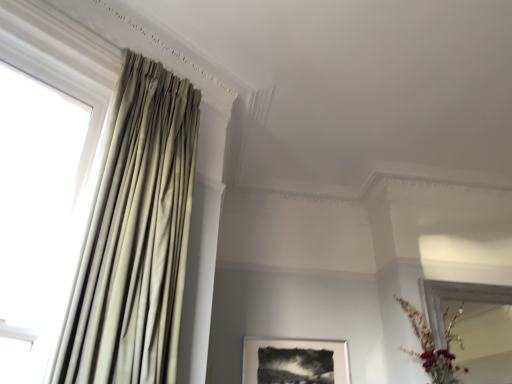
The height and width of the screenshot is (384, 512). Describe the element at coordinates (295, 361) in the screenshot. I see `black matte picture frame at center` at that location.

Image resolution: width=512 pixels, height=384 pixels. What do you see at coordinates (135, 235) in the screenshot? I see `satin beige curtain at left` at bounding box center [135, 235].

Where is `black matte picture frame at center`? The width and height of the screenshot is (512, 384). black matte picture frame at center is located at coordinates (295, 361).

Is black matte picture frame at center thinner than white fabric curtain at left?

Yes, black matte picture frame at center is thinner than white fabric curtain at left.

Based on the photo, considering the sizes of black matte picture frame at center and white fabric curtain at left in the image, is black matte picture frame at center taller or shorter than white fabric curtain at left?

Considering their sizes, black matte picture frame at center has less height than white fabric curtain at left.

From a real-world perspective, between black matte picture frame at center and white fabric curtain at left, who is vertically higher?

white fabric curtain at left, from a real-world perspective.

Is black matte picture frame at center beside satin beige curtain at left?

No, black matte picture frame at center is not touching satin beige curtain at left.

Is black matte picture frame at center facing away from satin beige curtain at left?

black matte picture frame at center does not have its back to satin beige curtain at left.

Between black matte picture frame at center and satin beige curtain at left, which one has smaller size?

With smaller size is black matte picture frame at center.

From a real-world perspective, which is physically below, black matte picture frame at center or satin beige curtain at left?

From a 3D spatial view, black matte picture frame at center is below.

Can you confirm if white fabric curtain at left is taller than matte gold vase at lower right?

Indeed, white fabric curtain at left has a greater height compared to matte gold vase at lower right.

Is white fabric curtain at left touching matte gold vase at lower right?

No, white fabric curtain at left is not making contact with matte gold vase at lower right.

Is white fabric curtain at left looking in the opposite direction of matte gold vase at lower right?

white fabric curtain at left does not have its back to matte gold vase at lower right.

From the image's perspective, is white fabric curtain at left above or below satin beige curtain at left?

Based on their image positions, white fabric curtain at left is located above satin beige curtain at left.

Does white fabric curtain at left touch satin beige curtain at left?

No, white fabric curtain at left is not with satin beige curtain at left.

Is the depth of white fabric curtain at left greater than that of satin beige curtain at left?

No, white fabric curtain at left is closer to the camera.

Which is farther, (64, 221) or (185, 175)?

Point (185, 175)

In the scene shown: From a real-world perspective, between black matte picture frame at center and matte gold vase at lower right, who is vertically lower?

In real-world perspective, black matte picture frame at center is lower.

Considering the relative sizes of black matte picture frame at center and matte gold vase at lower right in the image provided, is black matte picture frame at center bigger than matte gold vase at lower right?

No.

Is black matte picture frame at center to the left or to the right of matte gold vase at lower right in the image?

Based on their positions, black matte picture frame at center is located to the left of matte gold vase at lower right.

Is black matte picture frame at center wider than matte gold vase at lower right?

Incorrect, the width of black matte picture frame at center does not surpass that of matte gold vase at lower right.

From the image's perspective, is white fabric curtain at left above black matte picture frame at center?

Yes, from the image's perspective, white fabric curtain at left is above black matte picture frame at center.

In the scene shown: From a real-world perspective, is white fabric curtain at left above or below black matte picture frame at center?

In terms of real-world spatial position, white fabric curtain at left is above black matte picture frame at center.

Looking at this image, is white fabric curtain at left placed right next to black matte picture frame at center?

white fabric curtain at left and black matte picture frame at center are not in contact.

Which of these two, matte gold vase at lower right or white fabric curtain at left, is thinner?

With smaller width is matte gold vase at lower right.

Would you consider matte gold vase at lower right to be distant from white fabric curtain at left?

Indeed, matte gold vase at lower right is not near white fabric curtain at left.

Can you confirm if matte gold vase at lower right is shorter than white fabric curtain at left?

Yes, matte gold vase at lower right is shorter than white fabric curtain at left.

Is matte gold vase at lower right outside of white fabric curtain at left?

Indeed, matte gold vase at lower right is completely outside white fabric curtain at left.

Where is `window that appears above the black matte picture frame at center (from a real-world perspective)`? The image size is (512, 384). window that appears above the black matte picture frame at center (from a real-world perspective) is located at coordinates (51, 162).

Where is `picture frame lying below the satin beige curtain at left (from the image's perspective)`? This screenshot has width=512, height=384. picture frame lying below the satin beige curtain at left (from the image's perspective) is located at coordinates click(295, 361).

Looking at the image, which one is located closer to white fabric curtain at left, black matte picture frame at center or matte gold vase at lower right?

The object closer to white fabric curtain at left is black matte picture frame at center.

Considering their positions, is matte gold vase at lower right positioned further to black matte picture frame at center than white fabric curtain at left?

white fabric curtain at left is further to black matte picture frame at center.

Looking at the image, which one is located further to matte gold vase at lower right, white fabric curtain at left or satin beige curtain at left?

Based on the image, white fabric curtain at left appears to be further to matte gold vase at lower right.

Which object lies further to the anchor point white fabric curtain at left, black matte picture frame at center or satin beige curtain at left?

Among the two, black matte picture frame at center is located further to white fabric curtain at left.

When comparing their distances from matte gold vase at lower right, does black matte picture frame at center or white fabric curtain at left seem closer?

Among the two, black matte picture frame at center is located nearer to matte gold vase at lower right.

Looking at the image, which one is located closer to satin beige curtain at left, black matte picture frame at center or white fabric curtain at left?

white fabric curtain at left.

Consider the image. Estimate the real-world distances between objects in this image. Which object is further from matte gold vase at lower right, black matte picture frame at center or satin beige curtain at left?

Based on the image, satin beige curtain at left appears to be further to matte gold vase at lower right.

Based on their spatial positions, is satin beige curtain at left or matte gold vase at lower right closer to black matte picture frame at center?

matte gold vase at lower right.

Identify the location of curtain between white fabric curtain at left and matte gold vase at lower right. This screenshot has width=512, height=384. (135, 235).

At what (x,y) coordinates should I click in order to perform the action: click on floral arrangement positioned between satin beige curtain at left and black matte picture frame at center from near to far. Please return your answer as a coordinate pair (x, y). Looking at the image, I should click on (433, 346).

Locate an element on the screen. curtain between white fabric curtain at left and black matte picture frame at center from front to back is located at coordinates (135, 235).

Identify the location of picture frame situated between white fabric curtain at left and matte gold vase at lower right from left to right. (295, 361).